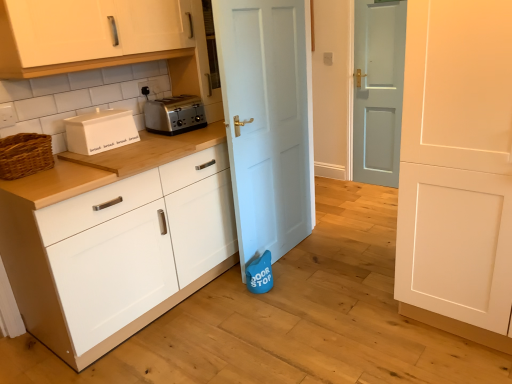
Find the location of a particular element. Image resolution: width=512 pixels, height=384 pixels. spots to the right of light blue matte door at center, acting as the second door starting from the front is located at coordinates (331, 255).